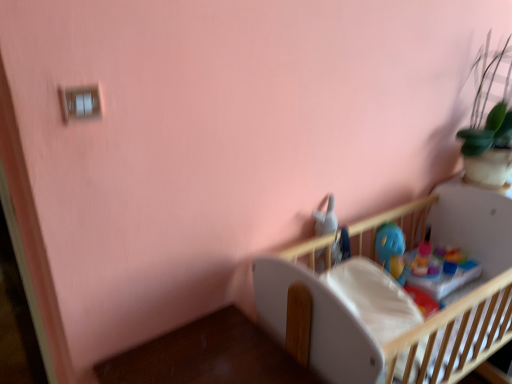
Question: In the image, is white matte table at lower right positioned in front of or behind blue plastic toy at upper center?

Choices:
 (A) front
 (B) behind

Answer: (A)

Question: Is white matte table at lower right taller or shorter than blue plastic toy at upper center?

Choices:
 (A) tall
 (B) short

Answer: (A)

Question: Based on their relative distances, which object is nearer to the white matte table at lower right?

Choices:
 (A) blue plastic toy at upper center
 (B) wooden crib at center

Answer: (B)

Question: Estimate the real-world distances between objects in this image. Which object is closer to the white matte table at lower right?

Choices:
 (A) wooden crib at center
 (B) blue plastic toy at upper center

Answer: (A)